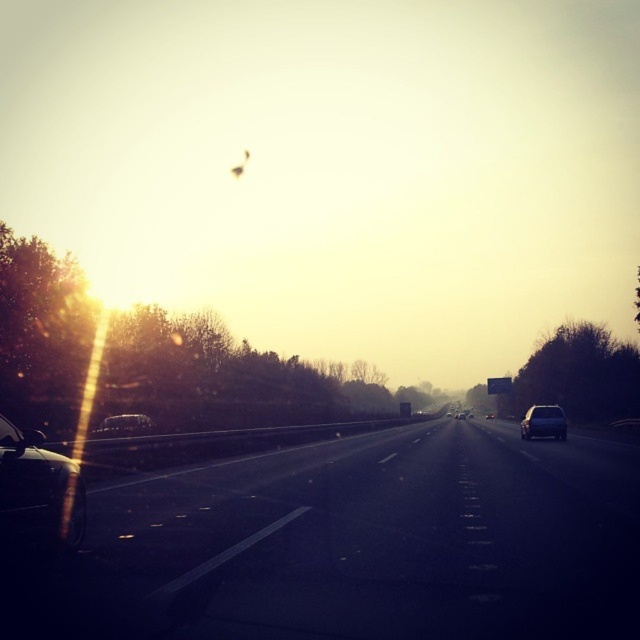
You are driving a car and see the satin black sedan at right and the satin black car at left on the highway. Which one is positioned more to the right side of the road?

The satin black sedan at right is positioned more to the right side of the road than the satin black car at left.

You are a driver approaching the black asphalt highway at center and see the satin black car at left ahead of you. Which object appears larger in your view?

The satin black car at left appears larger than the black asphalt highway at center because the description states that the black asphalt highway at center is smaller than the satin black car at left.

You are a driver approaching the black asphalt highway at center and see the satin silver sedan at center ahead of you. Can you safely change lanes to the right without crossing the road markings? Explain your reasoning based on the road and vehicle dimensions.

The black asphalt highway at center is wider than the satin silver sedan at center. Since the highway is wider, there is sufficient space to safely change lanes to the right without crossing the road markings.